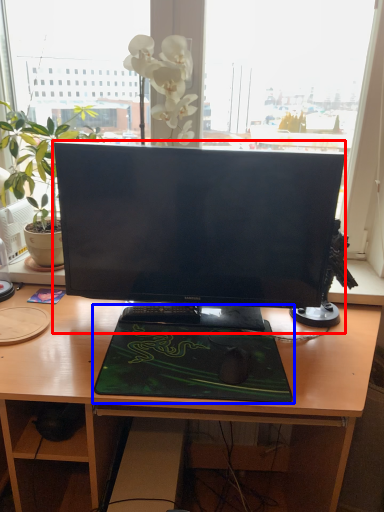
Question: Which object is closer to the camera taking this photo, computer monitor (highlighted by a red box) or desktop (highlighted by a blue box)?

Choices:
 (A) computer monitor
 (B) desktop

Answer: (B)